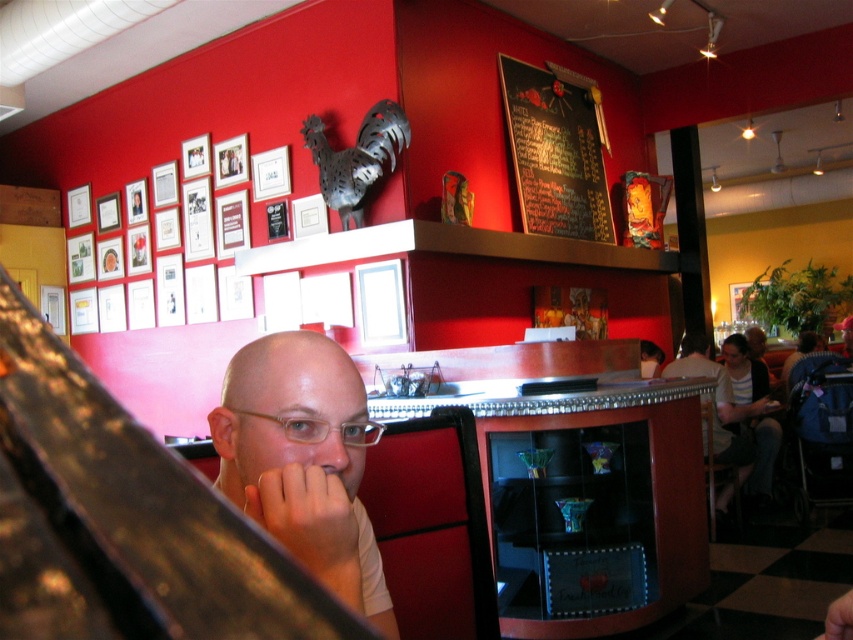
Question: Is black chalkboard at upper center bigger than clear plastic glasses at center?

Choices:
 (A) yes
 (B) no

Answer: (A)

Question: Which point is closer to the camera?

Choices:
 (A) clear plastic glasses at center
 (B) black chalkboard at upper center

Answer: (A)

Question: Which object appears farthest from the camera in this image?

Choices:
 (A) light skin tone flesh at lower center
 (B) black chalkboard at upper center
 (C) matte white shirt at center
 (D) clear plastic glasses at center

Answer: (B)

Question: Is matte white shirt at center below black chalkboard at upper center?

Choices:
 (A) yes
 (B) no

Answer: (A)

Question: Does black chalkboard at upper center appear over light skin tone flesh at lower center?

Choices:
 (A) no
 (B) yes

Answer: (B)

Question: Which of these objects is positioned farthest from the light skin tone flesh at lower center?

Choices:
 (A) black chalkboard at upper center
 (B) clear plastic glasses at center

Answer: (A)